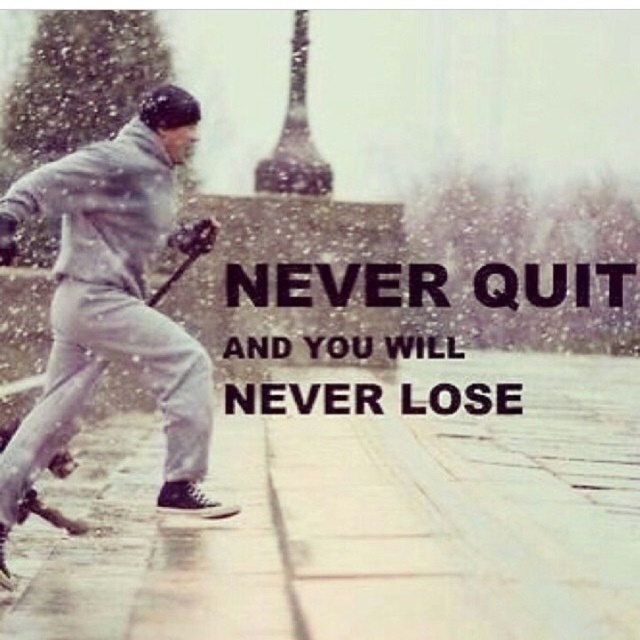
Based on the scene description, can you determine the spatial relationship between the gray matte ski pants at left and the shiny metallic eiffel tower at upper center?

The gray matte ski pants at left are positioned to the left of the shiny metallic eiffel tower at upper center.

You are an artist planning to paint a scene based on the image. You need to position the shiny metallic eiffel tower at upper center and the wooden bat at left in your painting. According to the image, which object should be placed to the right side of the other?

The shiny metallic eiffel tower at upper center should be placed to the right of the wooden bat at left as per the image.

You are an athlete preparing for a ski competition. You see the gray matte ski pants at left and the wooden bat at left in your equipment room. Which item should you pick up first if you want to grab the item that is closer to the floor?

The gray matte ski pants at left is positioned under the wooden bat at left, so you should pick up the gray matte ski pants at left first since it is closer to the floor.